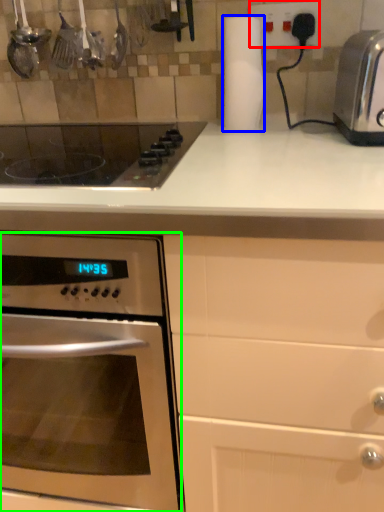
Question: Which is nearer to the electric outlet (highlighted by a red box)? paper towel (highlighted by a blue box) or oven (highlighted by a green box).

Choices:
 (A) paper towel
 (B) oven

Answer: (A)